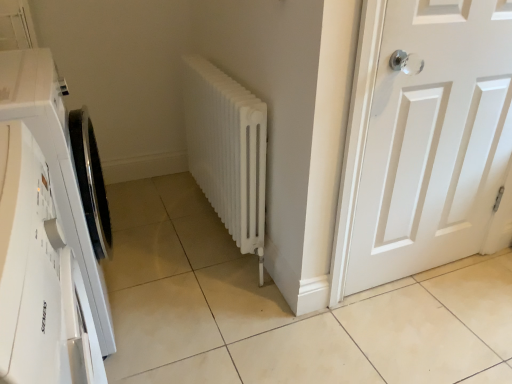
The width and height of the screenshot is (512, 384). In order to click on free space in front of white matte door at right in this screenshot , I will do `click(430, 326)`.